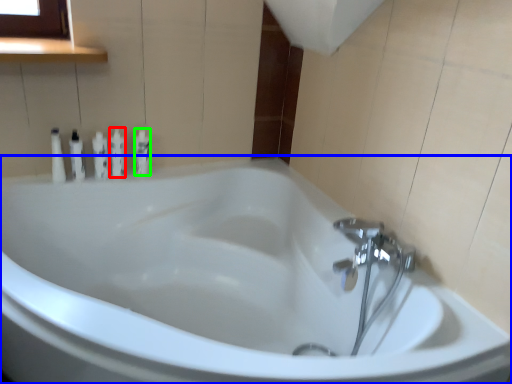
Question: Estimate the real-world distances between objects in this image. Which object is closer to toiletry (highlighted by a red box), bathtub (highlighted by a blue box) or toiletry (highlighted by a green box)?

Choices:
 (A) bathtub
 (B) toiletry

Answer: (B)